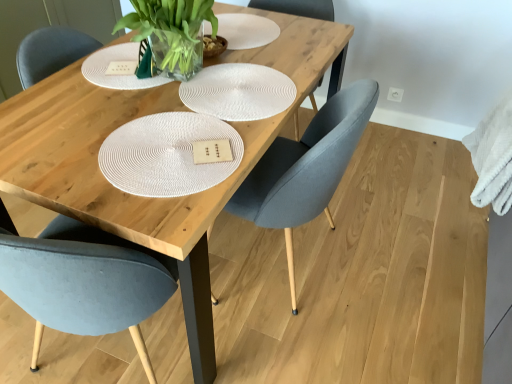
What are the coordinates of `free space on the front side of matte gray chair at center, which appears as the 2th chair when viewed from the left` in the screenshot? It's located at (317, 350).